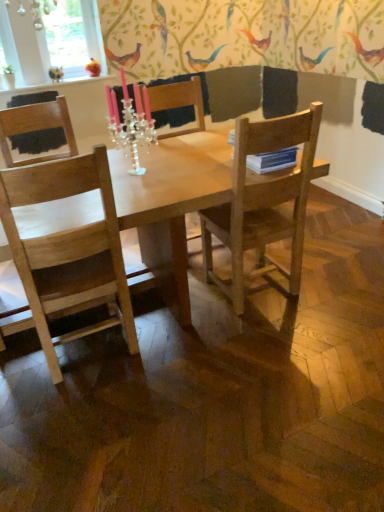
Locate an element on the screen. vacant point to the right of crystal clear candle holder at center is located at coordinates (175, 173).